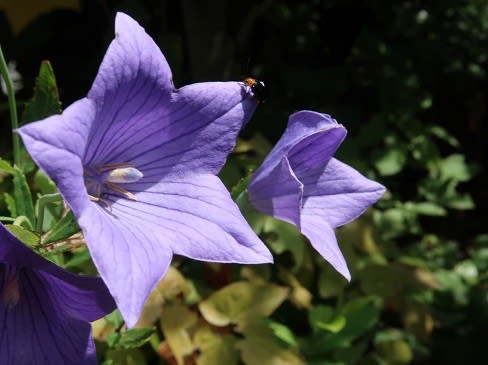
Identify the location of tan wall. (33, 8).